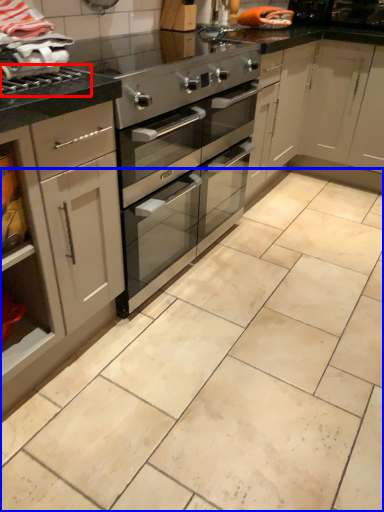
Question: Among these objects, which one is farthest to the camera, gas stove (highlighted by a red box) or counter (highlighted by a blue box)?

Choices:
 (A) gas stove
 (B) counter

Answer: (A)